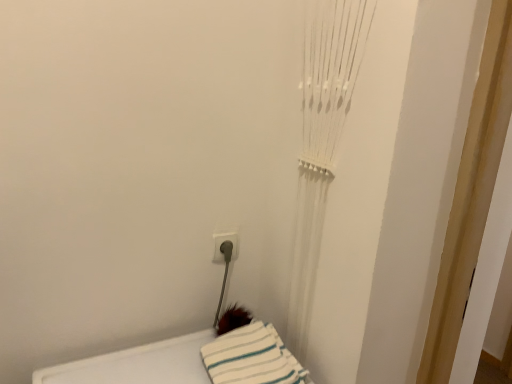
What do you see at coordinates (252, 357) in the screenshot? I see `white striped fabric at lower center` at bounding box center [252, 357].

Where is `white striped fabric at lower center`? The width and height of the screenshot is (512, 384). white striped fabric at lower center is located at coordinates (252, 357).

In order to face white plastic electric outlet at lower center, should I rotate leftwards or rightwards?

Rotate left and turn 4.036 degrees.

At what (x,y) coordinates should I click in order to perform the action: click on white plastic electric outlet at lower center. Please return your answer as a coordinate pair (x, y). The width and height of the screenshot is (512, 384). Looking at the image, I should click on (225, 245).

The image size is (512, 384). What do you see at coordinates (225, 245) in the screenshot? I see `white plastic electric outlet at lower center` at bounding box center [225, 245].

Measure the distance between white plastic electric outlet at lower center and camera.

white plastic electric outlet at lower center is 1.16 meters from camera.

What are the coordinates of `white striped fabric at lower center` in the screenshot? It's located at (252, 357).

Looking at this image, between white striped fabric at lower center and white plastic electric outlet at lower center, which one appears on the right side from the viewer's perspective?

Positioned to the right is white striped fabric at lower center.

Considering the positions of objects white striped fabric at lower center and white plastic electric outlet at lower center in the image provided, who is in front, white striped fabric at lower center or white plastic electric outlet at lower center?

white striped fabric at lower center is in front.

Between point (289, 371) and point (225, 238), which one is positioned behind?

Point (225, 238)

From the image's perspective, which is above, white striped fabric at lower center or white plastic electric outlet at lower center?

From the image's view, white plastic electric outlet at lower center is above.

From a real-world perspective, is white striped fabric at lower center on top of white plastic electric outlet at lower center?

Incorrect, from a real-world perspective, white striped fabric at lower center is lower than white plastic electric outlet at lower center.

Is white striped fabric at lower center thinner than white plastic electric outlet at lower center?

In fact, white striped fabric at lower center might be wider than white plastic electric outlet at lower center.

Is white striped fabric at lower center shorter than white plastic electric outlet at lower center?

Indeed, white striped fabric at lower center has a lesser height compared to white plastic electric outlet at lower center.

Can you confirm if white striped fabric at lower center is bigger than white plastic electric outlet at lower center?

Correct, white striped fabric at lower center is larger in size than white plastic electric outlet at lower center.

Is white striped fabric at lower center inside or outside of white plastic electric outlet at lower center?

white striped fabric at lower center cannot be found inside white plastic electric outlet at lower center.

Are white striped fabric at lower center and white plastic electric outlet at lower center beside each other?

white striped fabric at lower center and white plastic electric outlet at lower center are clearly separated.

Is white striped fabric at lower center oriented towards white plastic electric outlet at lower center?

No, white striped fabric at lower center does not turn towards white plastic electric outlet at lower center.

Can you tell me how much white striped fabric at lower center and white plastic electric outlet at lower center differ in facing direction?

white striped fabric at lower center and white plastic electric outlet at lower center are facing 1.16 degrees away from each other.

At what (x,y) coordinates should I click in order to perform the action: click on electric outlet positioned vertically above the white striped fabric at lower center (from a real-world perspective). Please return your answer as a coordinate pair (x, y). This screenshot has height=384, width=512. Looking at the image, I should click on (225, 245).

Considering the relative positions of white plastic electric outlet at lower center and white striped fabric at lower center in the image provided, is white plastic electric outlet at lower center to the left of white striped fabric at lower center from the viewer's perspective?

Indeed, white plastic electric outlet at lower center is positioned on the left side of white striped fabric at lower center.

Which object is further away from the camera, white plastic electric outlet at lower center or white striped fabric at lower center?

white plastic electric outlet at lower center is further from the camera.

Is point (220, 248) behind point (228, 357)?

Yes, point (220, 248) is farther from viewer.

From the image's perspective, which is below, white plastic electric outlet at lower center or white striped fabric at lower center?

white striped fabric at lower center.

From a real-world perspective, is white plastic electric outlet at lower center located higher than white striped fabric at lower center?

Correct, in the physical world, white plastic electric outlet at lower center is higher than white striped fabric at lower center.

Considering the relative sizes of white plastic electric outlet at lower center and white striped fabric at lower center in the image provided, is white plastic electric outlet at lower center thinner than white striped fabric at lower center?

Correct, the width of white plastic electric outlet at lower center is less than that of white striped fabric at lower center.

Considering the sizes of white plastic electric outlet at lower center and white striped fabric at lower center in the image, is white plastic electric outlet at lower center taller or shorter than white striped fabric at lower center?

Clearly, white plastic electric outlet at lower center is taller compared to white striped fabric at lower center.

Considering the sizes of objects white plastic electric outlet at lower center and white striped fabric at lower center in the image provided, who is bigger, white plastic electric outlet at lower center or white striped fabric at lower center?

white striped fabric at lower center.

Do you think white plastic electric outlet at lower center is within white striped fabric at lower center, or outside of it?

white plastic electric outlet at lower center lies outside white striped fabric at lower center.

Is white plastic electric outlet at lower center in contact with white striped fabric at lower center?

No, white plastic electric outlet at lower center is not next to white striped fabric at lower center.

Could you tell me if white plastic electric outlet at lower center is turned towards white striped fabric at lower center?

No, white plastic electric outlet at lower center does not turn towards white striped fabric at lower center.

How many degrees apart are the facing directions of white plastic electric outlet at lower center and white striped fabric at lower center?

1.16 degrees.

Identify the location of electric outlet that is on the left side of white striped fabric at lower center. (225, 245).

The image size is (512, 384). In order to click on sheet located on the right of white plastic electric outlet at lower center in this screenshot , I will do `click(252, 357)`.

In the image, there is a white plastic electric outlet at lower center. Where is `sheet below it (from the image's perspective)`? sheet below it (from the image's perspective) is located at coordinates (252, 357).